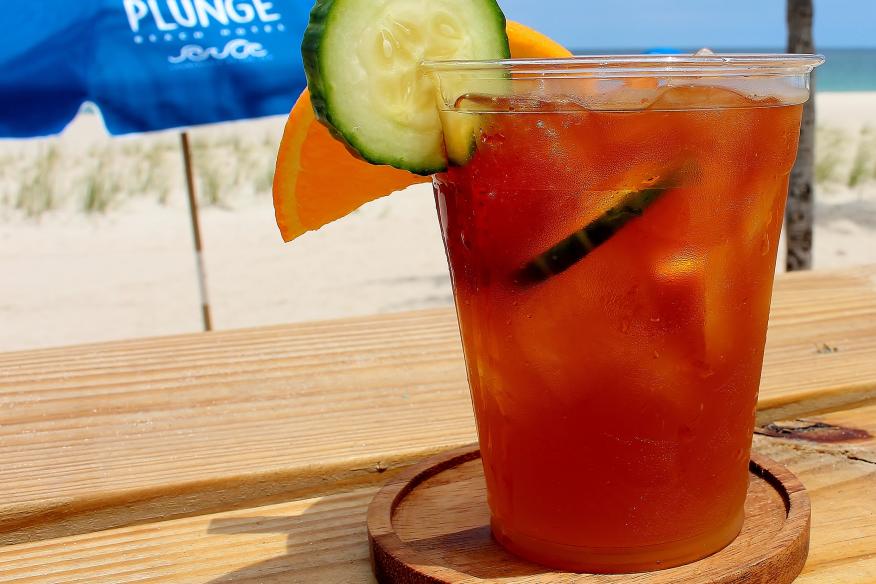
The height and width of the screenshot is (584, 876). I want to click on dark brown rounded coaster, so click(774, 559).